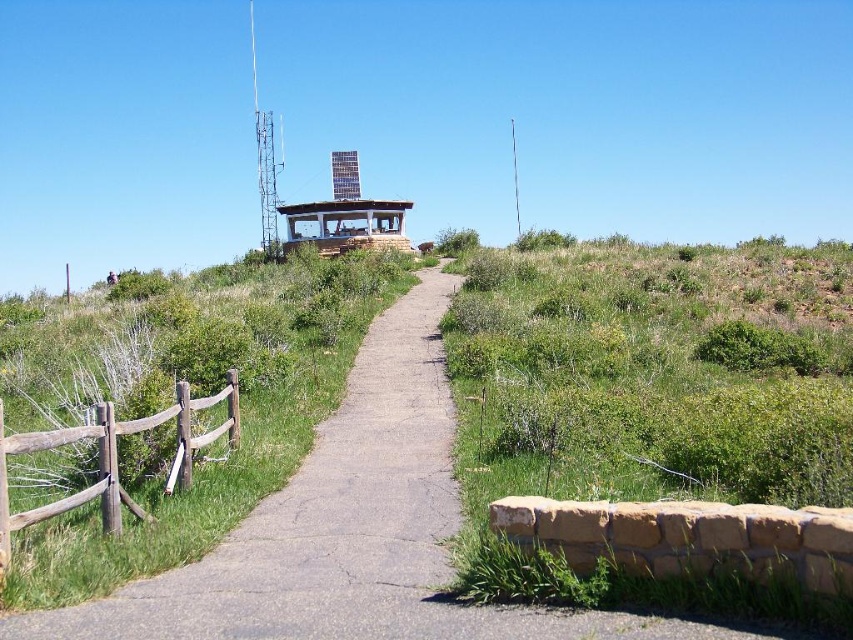
You are standing at the center of the image. Which direction should you walk to reach the brown wooden fence at left?

You should walk to the left to reach the brown wooden fence at left since it is located at the left side of the image.

In the scene shown: You are standing at the entrance of the wooden gazebo at center and want to walk towards the brown wooden fence at left. Which direction should you face to move towards it?

To move towards the brown wooden fence at left from the wooden gazebo at center, you should face the left direction since the brown wooden fence at left is positioned on the right side of the wooden gazebo at center.

You are planning to install a new bench along the pathway. The bench requires a clear space of 2 meters in front of it to ensure accessibility. Given the positions of the brown wooden fence at left and the wooden gazebo at center, where should you place the bench to avoid blocking the pathway?

The brown wooden fence at left is located below the wooden gazebo at center. Therefore, placing the bench between them would leave enough space in front of the bench, ensuring accessibility without obstructing the pathway.